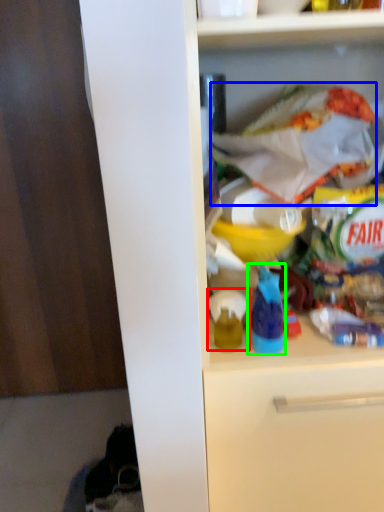
Question: Based on their relative distances, which object is farther from toy (highlighted by a red box)? Choose from material (highlighted by a blue box) and bottle (highlighted by a green box).

Choices:
 (A) material
 (B) bottle

Answer: (A)